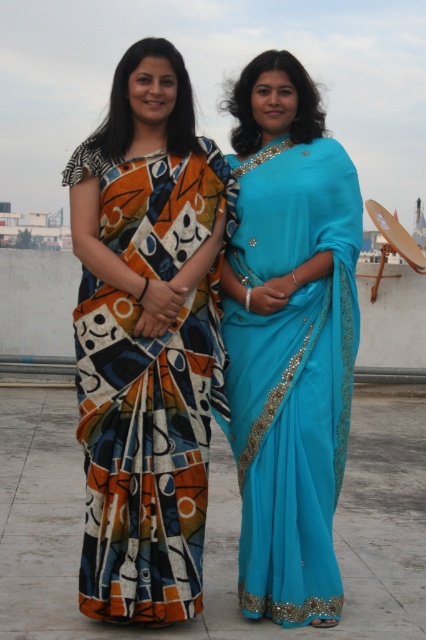
Question: Does turquoise satin saree at center lie behind abstract print fabric sari at left?

Choices:
 (A) no
 (B) yes

Answer: (B)

Question: Is turquoise satin saree at center in front of abstract print fabric sari at left?

Choices:
 (A) yes
 (B) no

Answer: (B)

Question: Does turquoise satin saree at center appear over abstract print fabric sari at left?

Choices:
 (A) no
 (B) yes

Answer: (B)

Question: Among these objects, which one is nearest to the camera?

Choices:
 (A) turquoise satin saree at center
 (B) abstract print fabric sari at left

Answer: (B)